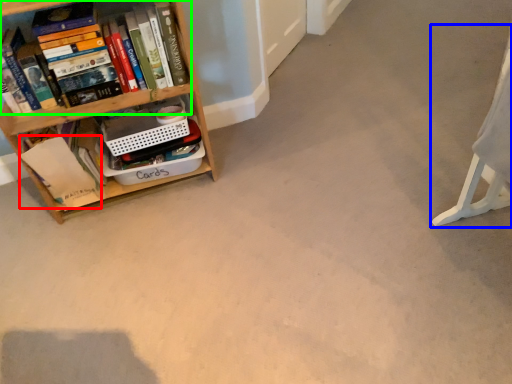
Question: Which object is positioned farthest from paperback book (highlighted by a red box)? Select from swivel chair (highlighted by a blue box) and book (highlighted by a green box).

Choices:
 (A) swivel chair
 (B) book

Answer: (A)